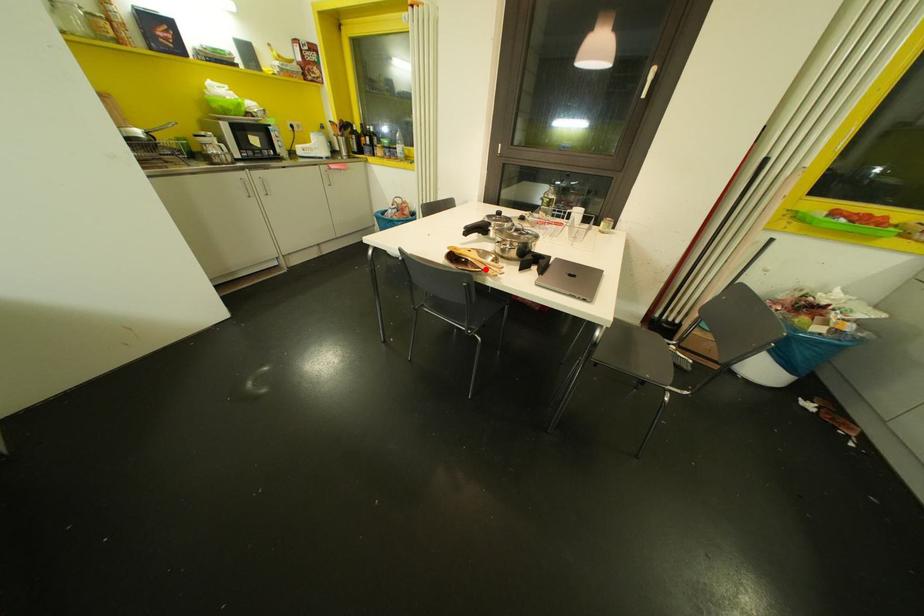
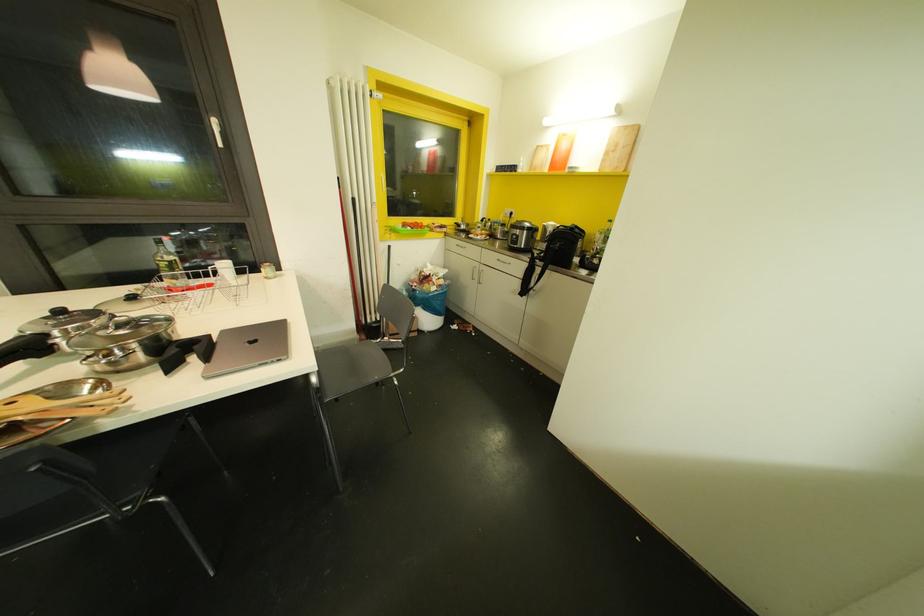
Find the pixel in the second image that matches the highlighted location in the first image.

(82, 413)